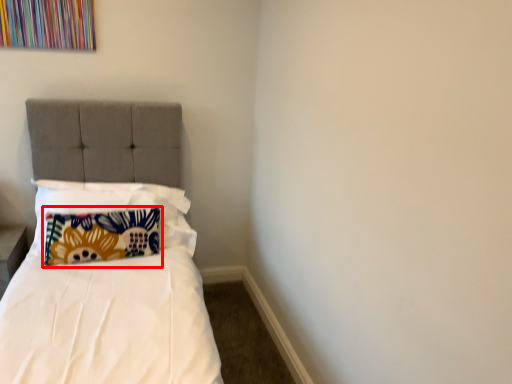
Question: Where is pillow (annotated by the red box) located in relation to pillow in the image?

Choices:
 (A) left
 (B) right

Answer: (A)